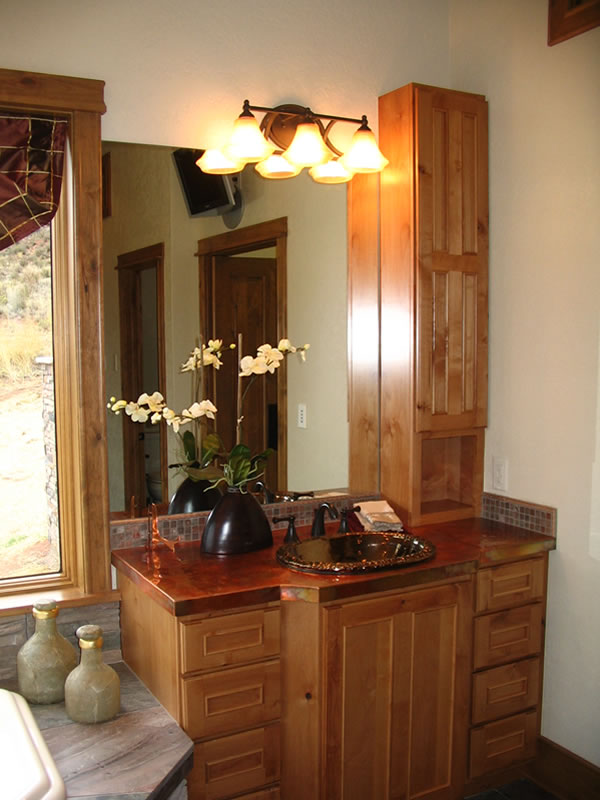
At what (x,y) coordinates should I click in order to perform the action: click on lights. Please return your answer as a coordinate pair (x, y). The image size is (600, 800). Looking at the image, I should click on (307, 154).